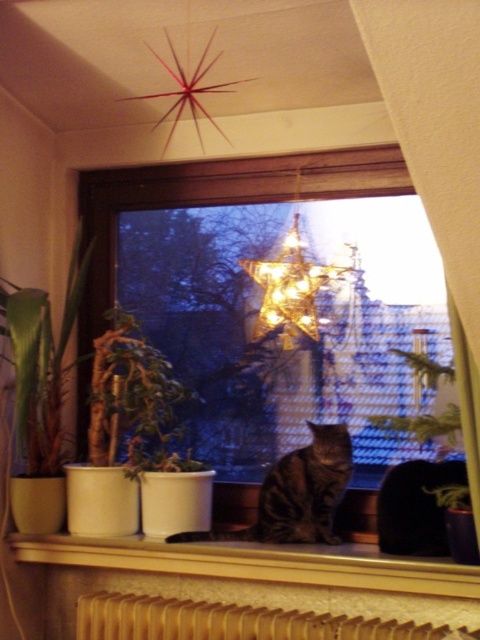
Question: Which point is closer to the camera?

Choices:
 (A) metallic star at center
 (B) green leafy plant at left
 (C) green matte plant at left
 (D) wooden radiator at lower center

Answer: (D)

Question: Is wooden radiator at lower center smaller than green matte plant at left?

Choices:
 (A) yes
 (B) no

Answer: (B)

Question: Is wooden radiator at lower center bigger than green leafy plant at left?

Choices:
 (A) yes
 (B) no

Answer: (B)

Question: Which of the following is the closest to the observer?

Choices:
 (A) (232, 628)
 (B) (308, 568)
 (C) (210, 204)

Answer: (A)

Question: Which point appears farthest from the camera in this image?

Choices:
 (A) (348, 449)
 (B) (311, 552)
 (C) (311, 184)

Answer: (C)

Question: Is green leafy plant at left to the left of dark gray fur cat at center from the viewer's perspective?

Choices:
 (A) no
 (B) yes

Answer: (B)